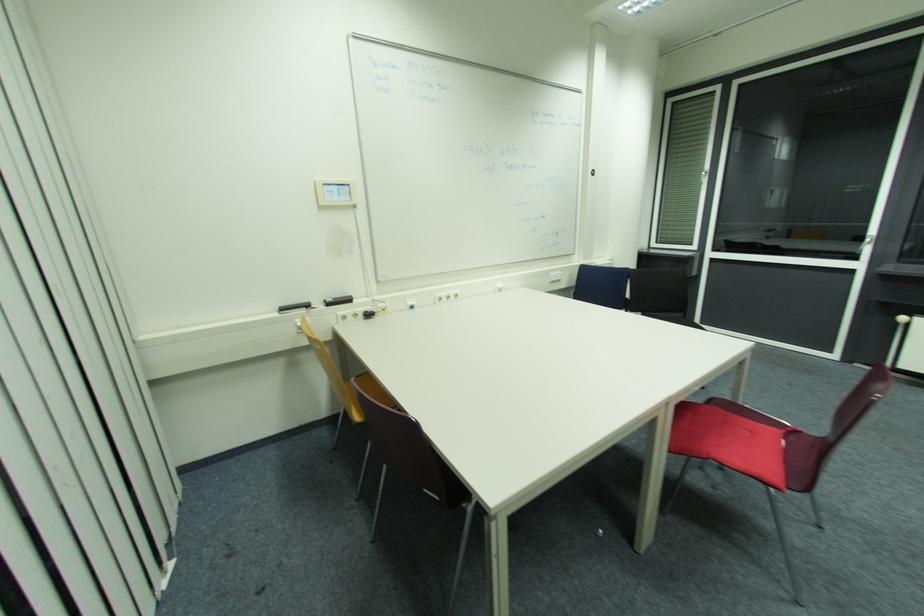
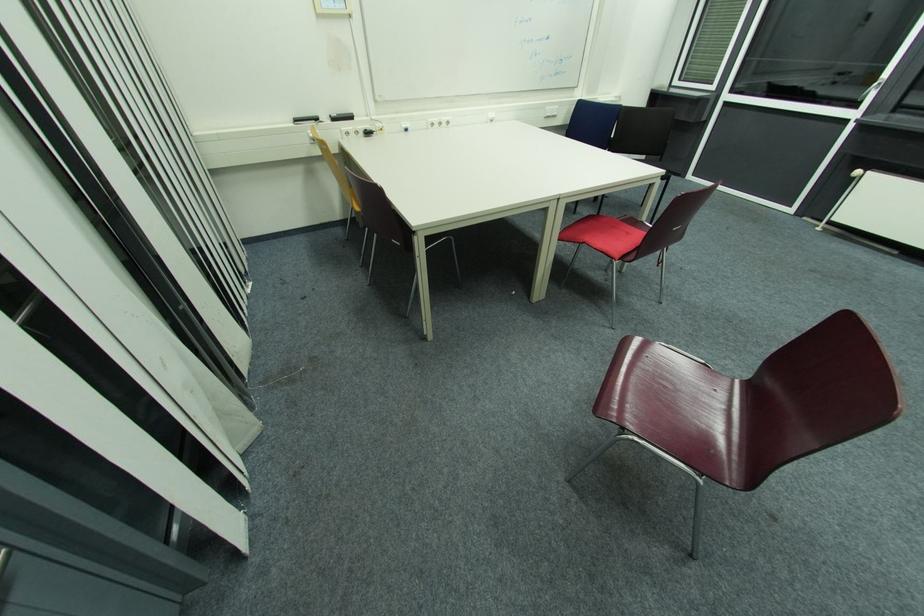
Locate, in the second image, the point that corresponds to point 286,310 in the first image.

(300, 121)